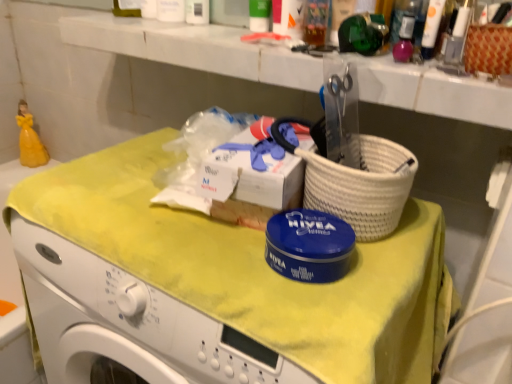
Where is `free space above white glossy counter top at upper center (from a real-world perspective)`? free space above white glossy counter top at upper center (from a real-world perspective) is located at coordinates (304, 41).